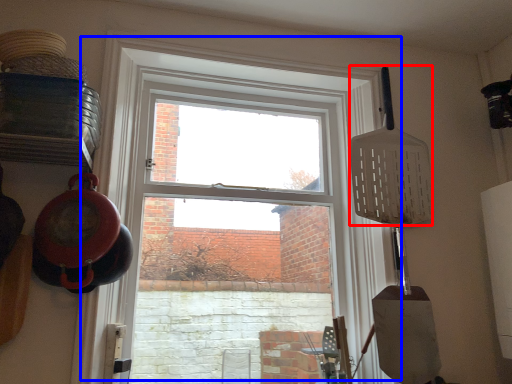
Question: Which of the following is the farthest to the observer, spatula (highlighted by a red box) or window (highlighted by a blue box)?

Choices:
 (A) spatula
 (B) window

Answer: (A)